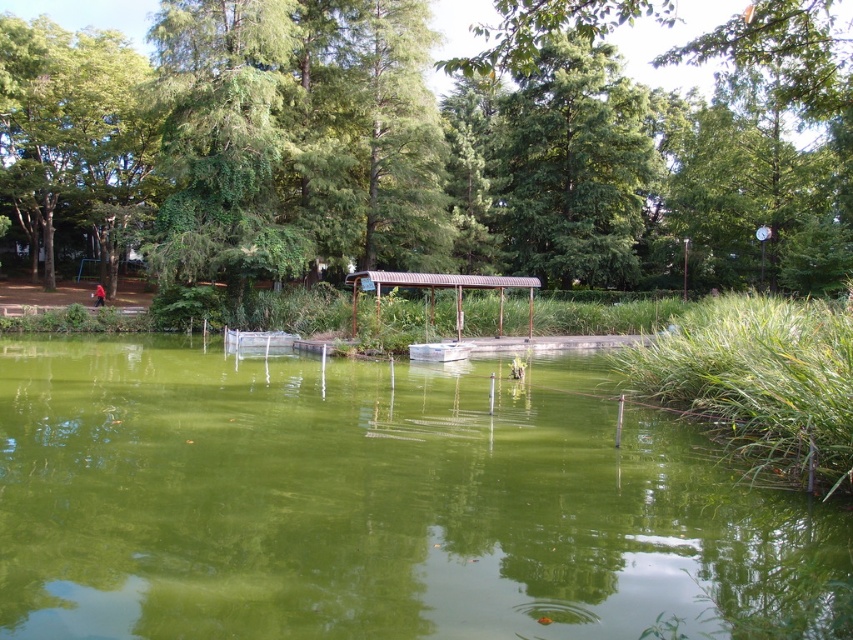
Question: Which object is farther from the camera taking this photo?

Choices:
 (A) green leafy tree at upper center
 (B) green algae water at center
 (C) green leafy tree at center

Answer: (A)

Question: Which point appears closest to the camera in this image?

Choices:
 (A) (519, 208)
 (B) (91, 225)
 (C) (456, 344)

Answer: (C)

Question: Is green algae water at center smaller than green leafy tree at upper center?

Choices:
 (A) no
 (B) yes

Answer: (B)

Question: Which point appears closest to the camera in this image?

Choices:
 (A) (97, 204)
 (B) (426, 356)
 (C) (828, 588)

Answer: (C)

Question: Can you confirm if green leafy tree at center is positioned to the left of green leafy tree at upper left?

Choices:
 (A) no
 (B) yes

Answer: (A)

Question: Can you confirm if green algae water at center is positioned to the right of metallic gray boat at center?

Choices:
 (A) yes
 (B) no

Answer: (B)